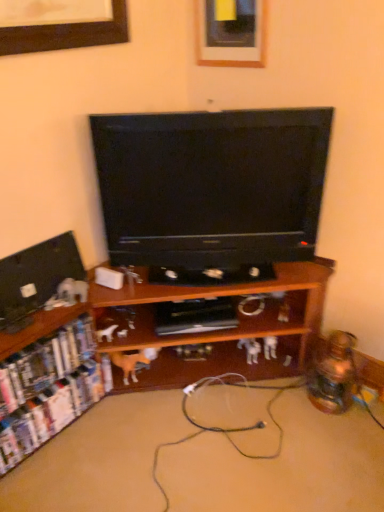
Question: In the image, is wooden shelf at center, the second shelf positioned from the left, positioned in front of or behind white cardboard shelf at lower left, the first shelf positioned from the left?

Choices:
 (A) behind
 (B) front

Answer: (B)

Question: From the image's perspective, is wooden shelf at center, arranged as the 1th shelf when viewed from the right, located above or below white cardboard shelf at lower left, the first shelf positioned from the left?

Choices:
 (A) above
 (B) below

Answer: (A)

Question: Which object is the closest to the wooden shelf at center, the second shelf positioned from the left?

Choices:
 (A) black glossy television at center
 (B) black rubber extension cord at lower center
 (C) matte wooden picture frame at upper center
 (D) white cardboard shelf at lower left, the first shelf positioned from the left
 (E) wooden shelf at lower left

Answer: (D)

Question: Considering the real-world distances, which object is farthest from the wooden shelf at center, arranged as the 1th shelf when viewed from the right?

Choices:
 (A) black rubber extension cord at lower center
 (B) white cardboard shelf at lower left, positioned as the second shelf in right-to-left order
 (C) matte wooden picture frame at upper center
 (D) wooden shelf at lower left
 (E) black glossy television at center

Answer: (C)